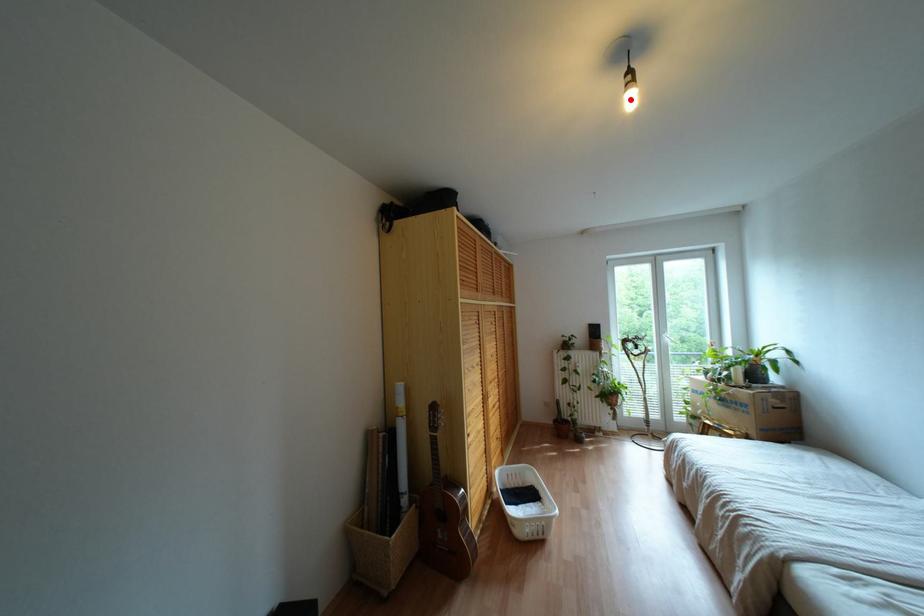
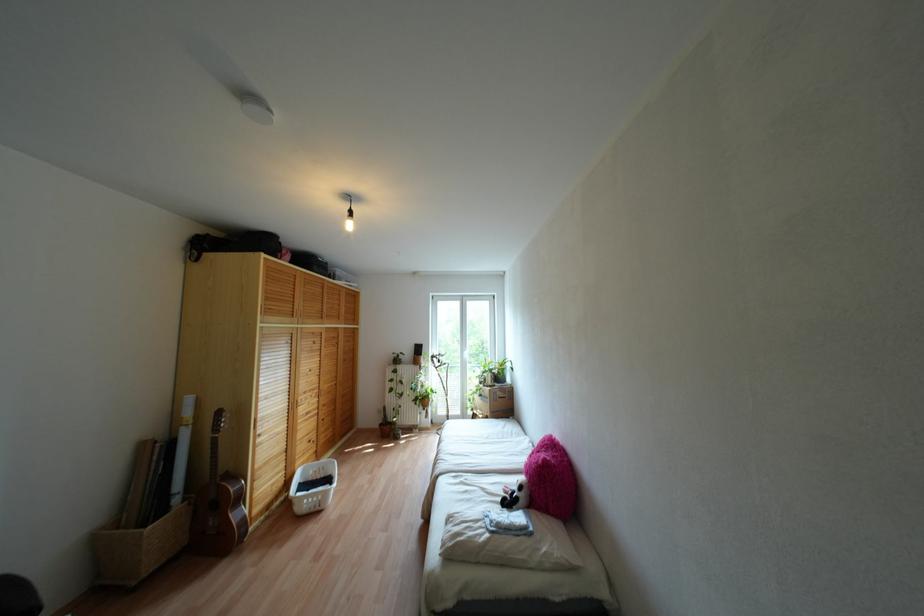
The point at the highlighted location is marked in the first image. Where is the corresponding point in the second image?

(348, 225)